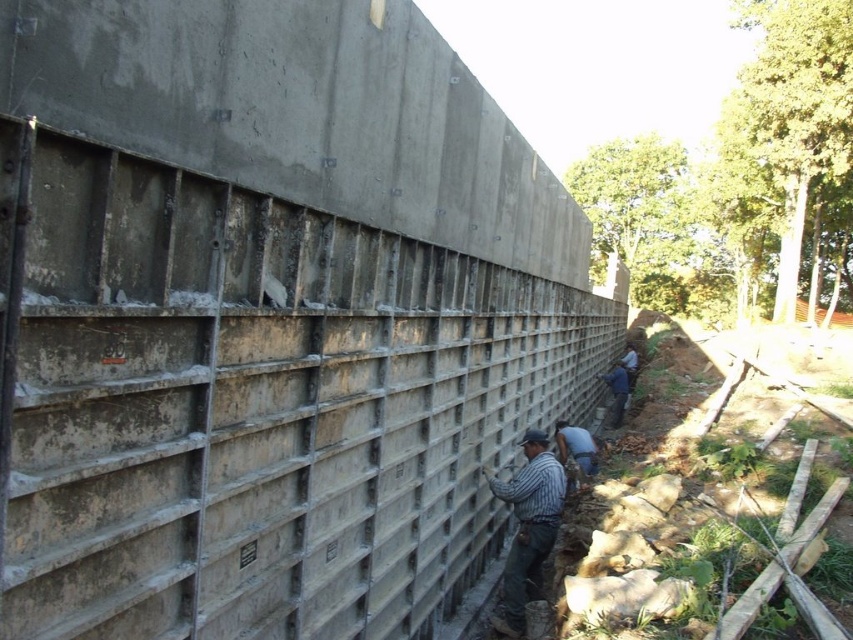
You are standing in front of the construction site and want to take a photo of the concrete wall at left and the striped cotton shirt at center. Which object should you focus on first to ensure both are in clear view?

The concrete wall at left is closer to the viewer than the striped cotton shirt at center, so focusing on the concrete wall at left will ensure both are in clear view.

Based on the photo, you are a construction worker standing at the point marked by the coordinates point [527,525]. You need to move to the wall on the left side of the frame. Which direction should you walk to reach the wall?

The wall is on the left side of the frame, so you should walk to the left to reach the wall.

You are a safety inspector at the construction site. You notice the concrete wall at left and the blue denim shirt at lower right. Based on their heights, which one should you prioritize inspecting for potential safety hazards related to height?

The concrete wall at left is much taller than the blue denim shirt at lower right, so you should prioritize inspecting the concrete wall at left for potential safety hazards related to height.